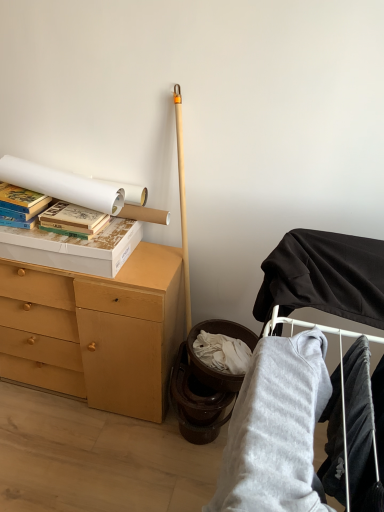
The height and width of the screenshot is (512, 384). I want to click on empty space that is ontop of light brown wood chest of drawers at left (from a real-world perspective), so click(x=119, y=267).